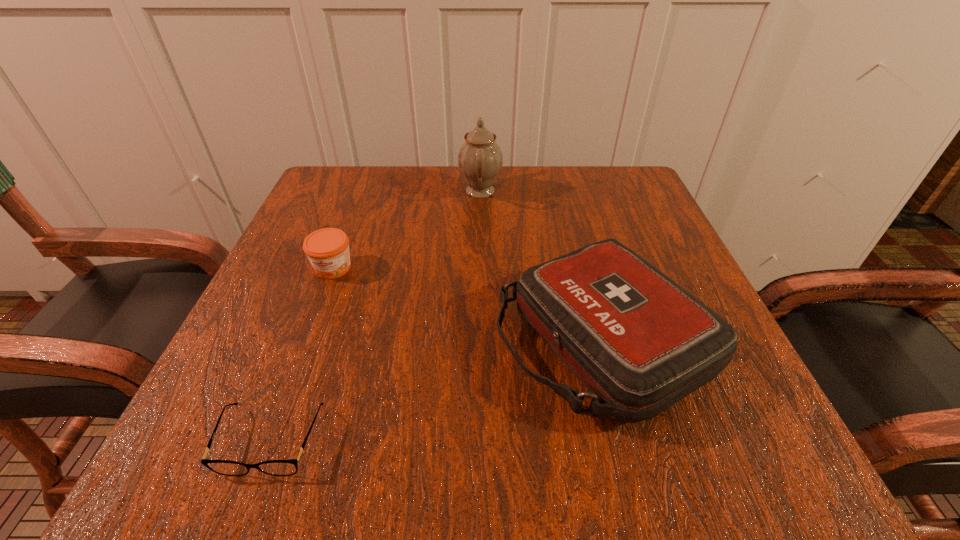
The height and width of the screenshot is (540, 960). Find the location of `free space between the third shortest object and the third tallest object`. free space between the third shortest object and the third tallest object is located at coordinates (467, 304).

The height and width of the screenshot is (540, 960). I want to click on vacant point located between the second shortest object and the first-aid kit, so click(467, 304).

You are a GUI agent. You are given a task and a screenshot of the screen. Output one action in this format:
    pyautogui.click(x=<x>, y=<y>)
    Task: Click on the free spot between the spectacles and the tallest object
    This screenshot has height=540, width=960.
    Given the screenshot: What is the action you would take?
    pyautogui.click(x=376, y=315)

At what (x,y) coordinates should I click in order to perform the action: click on free space between the jam and the farthest object. Please return your answer as a coordinate pair (x, y). Looking at the image, I should click on (407, 230).

Identify the location of vacant region between the spectacles and the second tallest object. (436, 390).

Locate which object is the third closest to the first-aid kit. Please provide its 2D coordinates. Your answer should be formatted as a tuple, i.e. [(x, y)], where the tuple contains the x and y coordinates of a point satisfying the conditions above.

[(327, 249)]

Locate an element on the screen. The width and height of the screenshot is (960, 540). object that is the closest one to the shortest object is located at coordinates (638, 342).

This screenshot has width=960, height=540. I want to click on vacant region that satisfies the following two spatial constraints: 1. on the spout of the farthest object; 2. on the left side of the third shortest object, so click(480, 341).

Where is `blank space that satisfies the following two spatial constraints: 1. on the spout of the tallest object; 2. on the front label of the jam`? The width and height of the screenshot is (960, 540). blank space that satisfies the following two spatial constraints: 1. on the spout of the tallest object; 2. on the front label of the jam is located at coordinates (480, 268).

This screenshot has height=540, width=960. Identify the location of vacant region that satisfies the following two spatial constraints: 1. on the spout of the farthest object; 2. on the front-facing side of the shortest object. (480, 441).